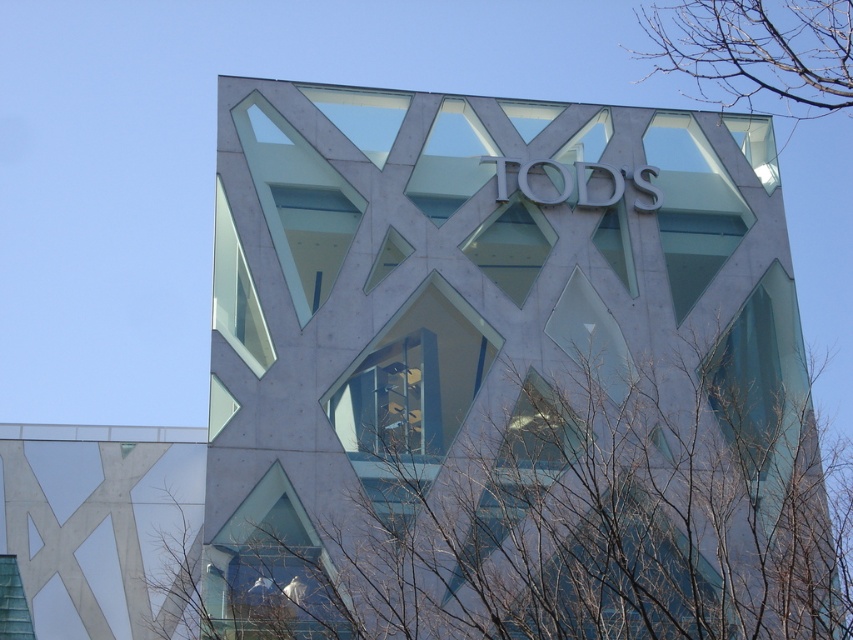
You are standing at the base of the TODS building and want to reach the point marked at coordinates point [548,492]. Given that the building is 200 feet tall, can you estimate whether the point is located above or below the building?

The point marked at coordinates point [548,492] is 200.01 feet away from the viewer, which is slightly farther than the building height of 200 feet. This suggests the point is located above the building.

You are standing in front of the TODS building and notice two sets of bare branches. One is at the lower left and the other at the upper right. From your perspective, which direction would you turn to look from the bare branches at lower left to the bare branches at upper right?

To look from the bare branches at lower left to the bare branches at upper right, you would turn to your right. Since the bare branches at lower left is to the left of bare branches at upper right, turning right would align your gaze towards the upper right direction.